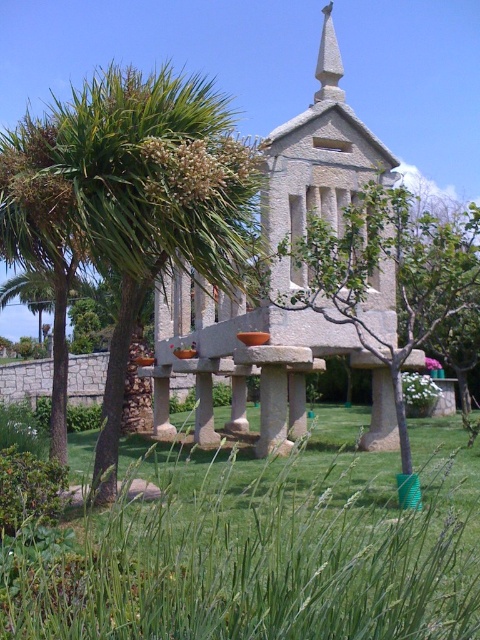
Question: Among these points, which one is farthest from the camera?

Choices:
 (A) (364, 528)
 (B) (333, 77)
 (C) (86, 156)
 (D) (310, 312)

Answer: (B)

Question: Does green leafy tree at center have a smaller size compared to white stone spire at upper center?

Choices:
 (A) no
 (B) yes

Answer: (A)

Question: From the image, what is the correct spatial relationship of green leafy tree at center in relation to stone chapel at center?

Choices:
 (A) left
 (B) right

Answer: (B)

Question: Can you confirm if green leafy tree at center is positioned to the left of stone chapel at center?

Choices:
 (A) no
 (B) yes

Answer: (A)

Question: Which point appears farthest from the camera in this image?

Choices:
 (A) (78, 579)
 (B) (132, 232)
 (C) (273, 312)

Answer: (C)

Question: Estimate the real-world distances between objects in this image. Which object is closer to the green grass at center?

Choices:
 (A) green leafy tree at center
 (B) white stone spire at upper center
 (C) green leafy palm tree at center
 (D) stone chapel at center

Answer: (A)